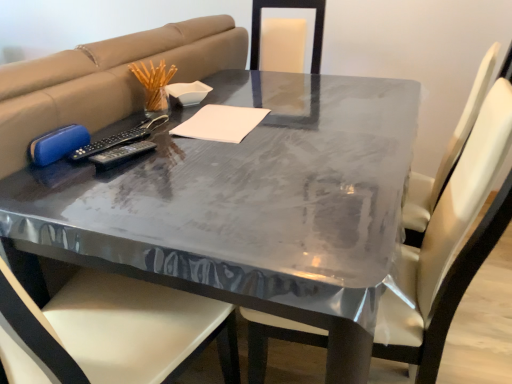
Find the location of a particular element. The height and width of the screenshot is (384, 512). vacant area to the left of black plastic remote at center is located at coordinates (53, 175).